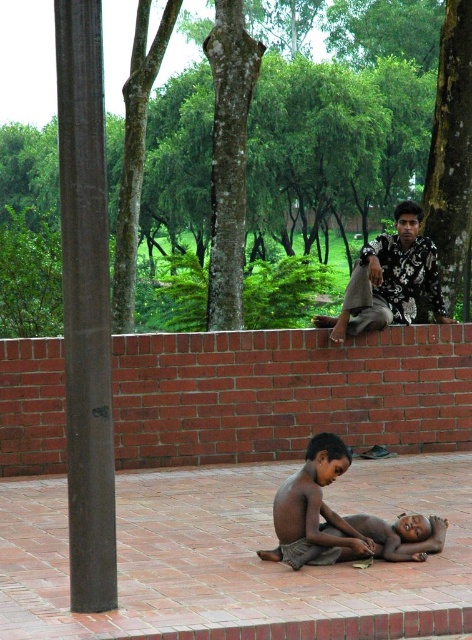
Question: Can you confirm if brown polished wood at left is bigger than brown skin child at lower center?

Choices:
 (A) yes
 (B) no

Answer: (A)

Question: Which object is farther from the camera taking this photo?

Choices:
 (A) dark skin baby at lower center
 (B) brown skin child at lower center
 (C) floral shirt at upper right

Answer: (C)

Question: Which of the following is the closest to the observer?

Choices:
 (A) tap(61, 150)
 (B) tap(423, 214)

Answer: (A)

Question: Which point is farther from the camera taking this photo?

Choices:
 (A) (310, 513)
 (B) (350, 125)

Answer: (B)

Question: Where is brown polished wood at left located in relation to dark skin baby at lower center in the image?

Choices:
 (A) left
 (B) right

Answer: (A)

Question: Can you confirm if brown polished wood at left is wider than dark skin baby at lower center?

Choices:
 (A) yes
 (B) no

Answer: (B)